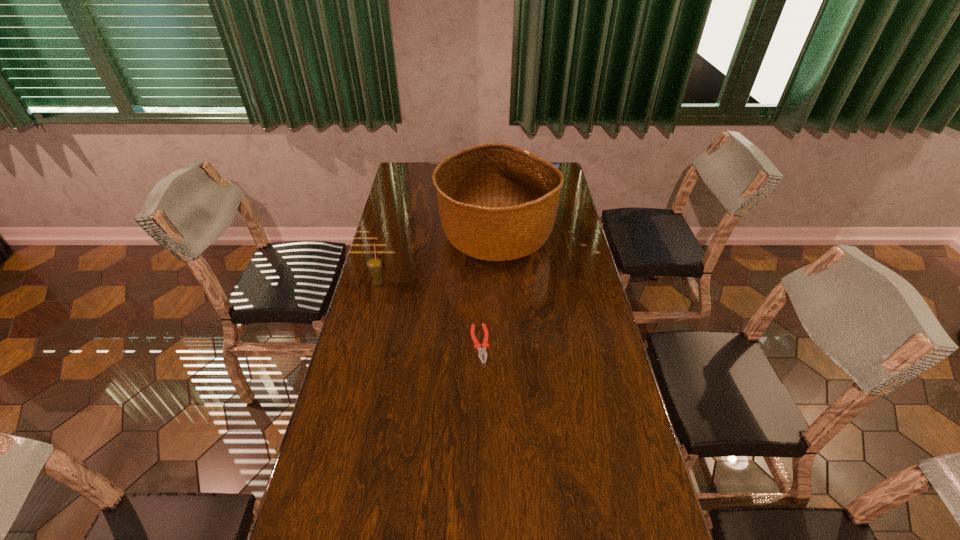
At what (x,y) coordinates should I click in order to perform the action: click on object that is at the right edge. Please return your answer as a coordinate pair (x, y). Image resolution: width=960 pixels, height=540 pixels. Looking at the image, I should click on (497, 202).

The image size is (960, 540). In the image, there is a desktop. What are the coordinates of `vacant space at the left edge` in the screenshot? It's located at (310, 501).

You are a GUI agent. You are given a task and a screenshot of the screen. Output one action in this format:
    pyautogui.click(x=<x>, y=<y>)
    Task: Click on the vacant space at the right edge
    
    Given the screenshot: What is the action you would take?
    pyautogui.click(x=564, y=300)

Identify the location of vacant position at the far left corner of the desktop. (402, 173).

You are a GUI agent. You are given a task and a screenshot of the screen. Output one action in this format:
    pyautogui.click(x=<x>, y=<y>)
    Task: Click on the free space between the tallest object and the leftmost object
    Image resolution: width=960 pixels, height=540 pixels.
    Given the screenshot: What is the action you would take?
    pyautogui.click(x=437, y=259)

Locate an element on the screen. The image size is (960, 540). vacant space that is in between the second tallest object and the basket is located at coordinates [x=437, y=259].

In order to click on vacant region between the nearest object and the straw for drinking in this screenshot , I will do `click(429, 313)`.

Where is `vacant space in between the basket and the nearest object`? vacant space in between the basket and the nearest object is located at coordinates (488, 289).

This screenshot has height=540, width=960. In order to click on vacant space in between the pliers and the farthest object in this screenshot , I will do `click(488, 289)`.

Identify the location of free space between the shortest object and the second tallest object. Image resolution: width=960 pixels, height=540 pixels. (429, 313).